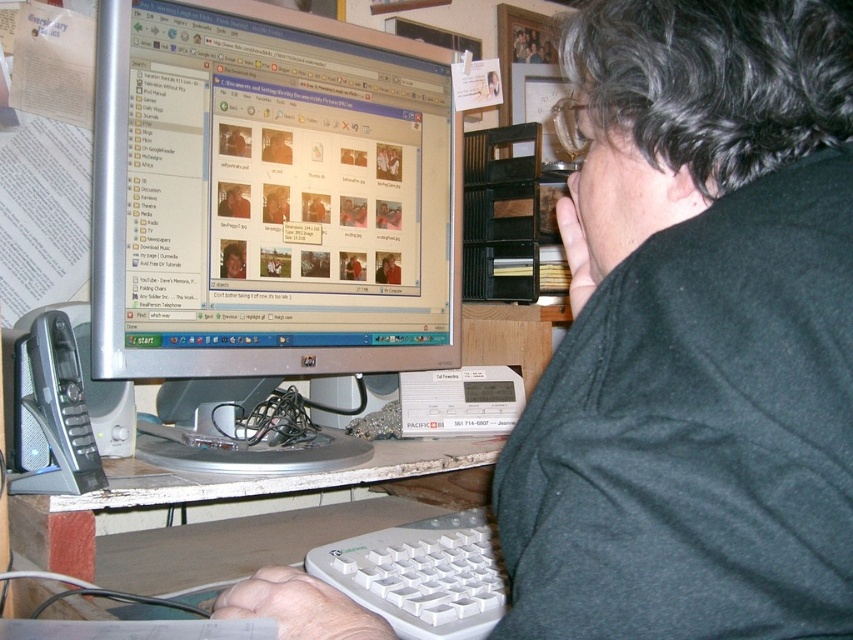
You are a delivery person who just arrived at the office. You need to place a new keyboard on the desk. The desk has a silver metallic monitor at center located at point (270, 195). Where should you place the new keyboard so it doesn not block the monitor?

Place the new keyboard to the left or right of the silver metallic monitor at center located at point (270, 195), ensuring it does not cover the monitor.

You are standing in front of the desk and see a point marked at coordinates (387,58). If you want to place a ruler that is 1 meter long on the desk to reach that point from where you are standing, will it be long enough?

The distance between you and the point marked at coordinates (387,58) is 98.97 centimeters. Since the ruler is 1 meter long, it will be long enough to reach the point.

You are a person who wants to place a mouse on the desk. The mouse is currently to the left of the white plastic keyboard at lower center. Where should you place the mouse so that it is on the white plastic table at lower center?

The mouse should be placed to the left of the white plastic keyboard at lower center because the white plastic keyboard at lower center is already positioned to the right of the white plastic table at lower center, so moving the mouse to the left of the keyboard would place it on the table.